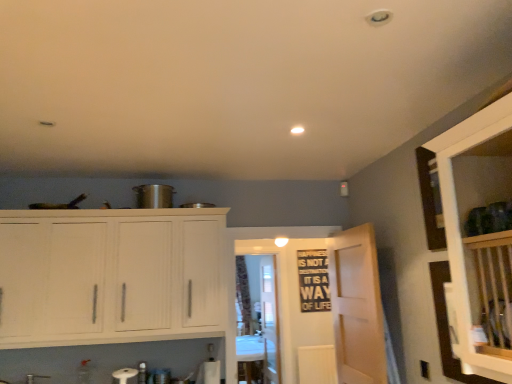
Question: From the image's perspective, is black matte bulletin board at center above patterned fabric curtain at center?

Choices:
 (A) yes
 (B) no

Answer: (A)

Question: Is black matte bulletin board at center next to patterned fabric curtain at center and touching it?

Choices:
 (A) yes
 (B) no

Answer: (B)

Question: From a real-world perspective, is black matte bulletin board at center beneath patterned fabric curtain at center?

Choices:
 (A) no
 (B) yes

Answer: (A)

Question: Does black matte bulletin board at center have a smaller size compared to patterned fabric curtain at center?

Choices:
 (A) no
 (B) yes

Answer: (B)

Question: Does black matte bulletin board at center have a greater height compared to patterned fabric curtain at center?

Choices:
 (A) yes
 (B) no

Answer: (B)

Question: Based on their sizes in the image, would you say white wood cabinets at left is bigger or smaller than black matte bulletin board at center?

Choices:
 (A) small
 (B) big

Answer: (B)

Question: Considering the relative positions of white wood cabinets at left and black matte bulletin board at center in the image provided, is white wood cabinets at left to the left or to the right of black matte bulletin board at center?

Choices:
 (A) left
 (B) right

Answer: (A)

Question: Is white wood cabinets at left situated inside black matte bulletin board at center or outside?

Choices:
 (A) inside
 (B) outside

Answer: (B)

Question: Does point (52, 218) appear closer or farther from the camera than point (323, 266)?

Choices:
 (A) farther
 (B) closer

Answer: (B)

Question: Visually, is transparent glass door at center, arranged as the second glass door when viewed from the front, positioned to the left or to the right of patterned fabric curtain at center?

Choices:
 (A) left
 (B) right

Answer: (B)

Question: Based on their sizes in the image, would you say transparent glass door at center, arranged as the second glass door when viewed from the front, is bigger or smaller than patterned fabric curtain at center?

Choices:
 (A) small
 (B) big

Answer: (A)

Question: Is transparent glass door at center, placed as the first glass door when sorted from back to front, wider or thinner than patterned fabric curtain at center?

Choices:
 (A) thin
 (B) wide

Answer: (A)

Question: From a real-world perspective, is transparent glass door at center, placed as the first glass door when sorted from back to front, above or below patterned fabric curtain at center?

Choices:
 (A) below
 (B) above

Answer: (A)

Question: In terms of width, does light wood door at center look wider or thinner when compared to patterned fabric curtain at center?

Choices:
 (A) wide
 (B) thin

Answer: (B)

Question: Considering the positions of light wood door at center and patterned fabric curtain at center in the image, is light wood door at center taller or shorter than patterned fabric curtain at center?

Choices:
 (A) short
 (B) tall

Answer: (A)